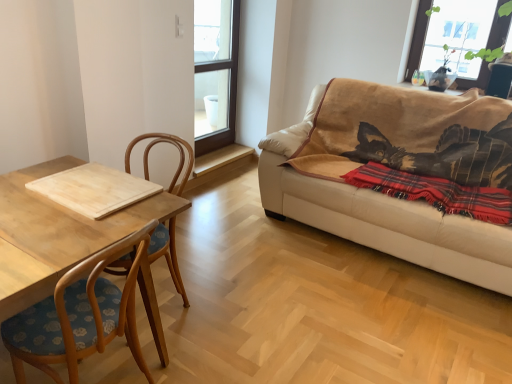
Question: Should I look upward or downward to see light wood cutting board at left?

Choices:
 (A) down
 (B) up

Answer: (B)

Question: Does red plaid blanket at right have a larger size compared to beige leather couch at right?

Choices:
 (A) no
 (B) yes

Answer: (A)

Question: From the image's perspective, is red plaid blanket at right on top of beige leather couch at right?

Choices:
 (A) yes
 (B) no

Answer: (B)

Question: Is red plaid blanket at right facing towards beige leather couch at right?

Choices:
 (A) yes
 (B) no

Answer: (A)

Question: Would you say red plaid blanket at right contains beige leather couch at right?

Choices:
 (A) no
 (B) yes

Answer: (A)

Question: Is red plaid blanket at right not close to beige leather couch at right?

Choices:
 (A) no
 (B) yes

Answer: (A)

Question: Is red plaid blanket at right positioned before beige leather couch at right?

Choices:
 (A) no
 (B) yes

Answer: (A)

Question: From a real-world perspective, is transparent glass window at upper right, which is counted as the second window, starting from the left, positioned under light wood cutting board at left based on gravity?

Choices:
 (A) yes
 (B) no

Answer: (B)

Question: Does transparent glass window at upper right, which is the first window from right to left, have a lesser height compared to light wood cutting board at left?

Choices:
 (A) no
 (B) yes

Answer: (B)

Question: Is transparent glass window at upper right, which is the first window from right to left, located outside light wood cutting board at left?

Choices:
 (A) no
 (B) yes

Answer: (B)

Question: From the image's perspective, is transparent glass window at upper right, which is counted as the second window, starting from the left, located beneath light wood cutting board at left?

Choices:
 (A) no
 (B) yes

Answer: (A)

Question: Can you confirm if transparent glass window at upper right, which is counted as the second window, starting from the left, is thinner than light wood cutting board at left?

Choices:
 (A) yes
 (B) no

Answer: (A)

Question: Does transparent glass window at upper right, which is the first window from right to left, appear on the left side of light wood cutting board at left?

Choices:
 (A) no
 (B) yes

Answer: (A)

Question: Is light wood cutting board at left at the left side of red plaid blanket at right?

Choices:
 (A) no
 (B) yes

Answer: (B)